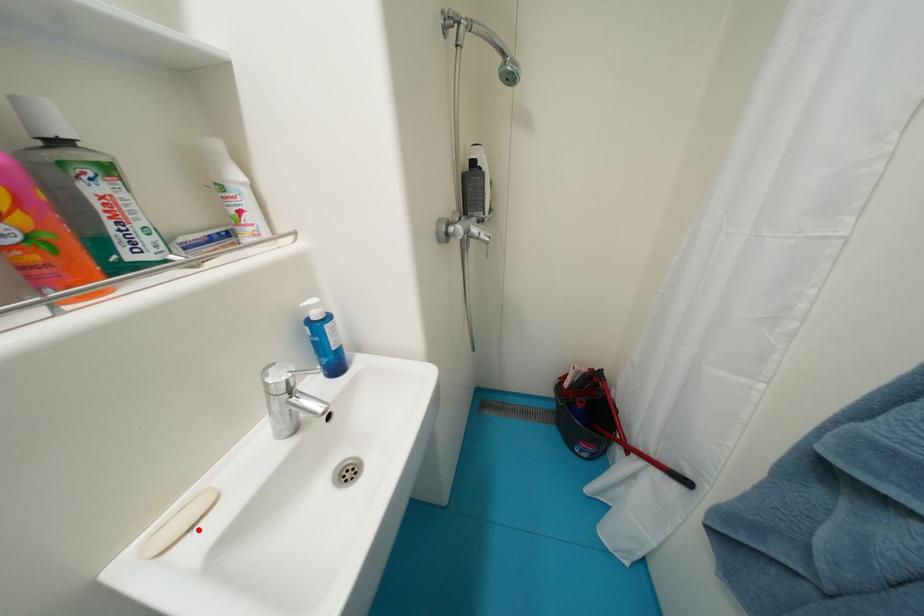
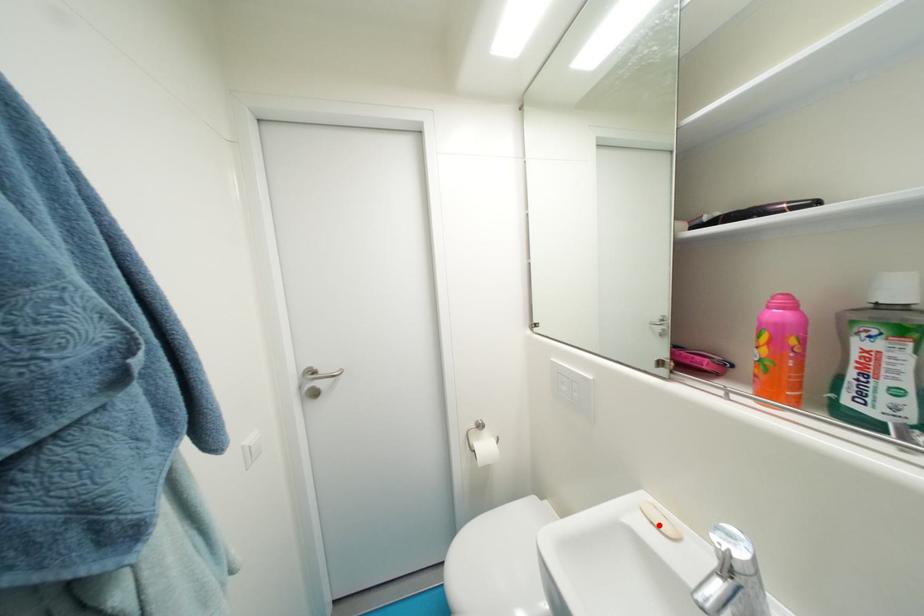
I am providing you with two images of the same scene from different viewpoints. A red point is marked on the first image and another point is marked on the second image. Is the marked point in image1 the same physical position as the marked point in image2?

Yes